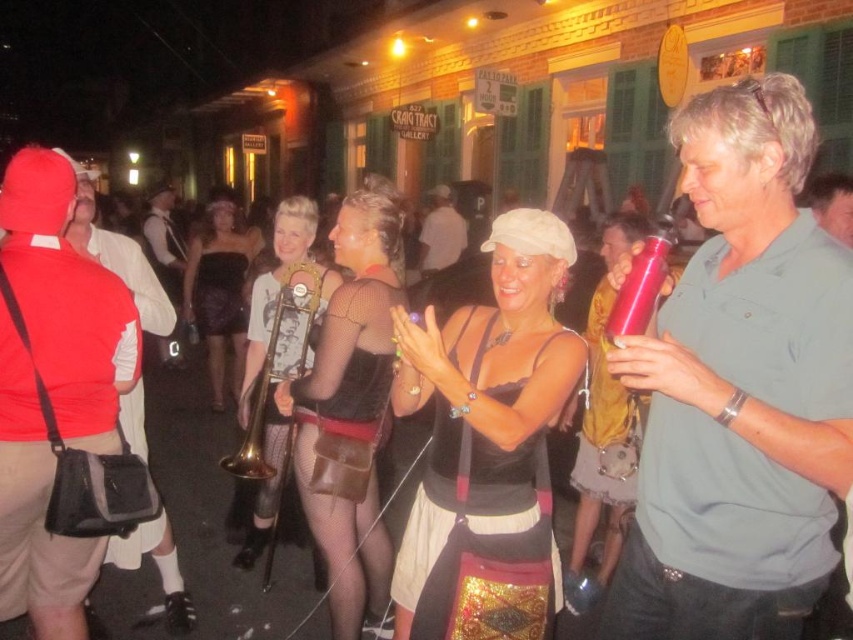
Question: Can you confirm if matte red shirt at left is positioned to the left of matte black hat at center?

Choices:
 (A) yes
 (B) no

Answer: (A)

Question: Which object appears closest to the camera in this image?

Choices:
 (A) white cotton shirt at center
 (B) matte black hat at center

Answer: (A)

Question: Which object is closer to the camera taking this photo?

Choices:
 (A) gold metallic trombone at center
 (B) matte black hat at center
 (C) matte black dress at center

Answer: (C)

Question: Is the position of matte red shirt at left less distant than that of black leather dress at center?

Choices:
 (A) no
 (B) yes

Answer: (B)

Question: Does matte red shirt at left appear under matte black dress at center?

Choices:
 (A) no
 (B) yes

Answer: (A)

Question: Among these points, which one is farthest from the camera?

Choices:
 (A) (726, 452)
 (B) (328, 365)
 (C) (242, 353)
 (D) (254, 289)

Answer: (C)